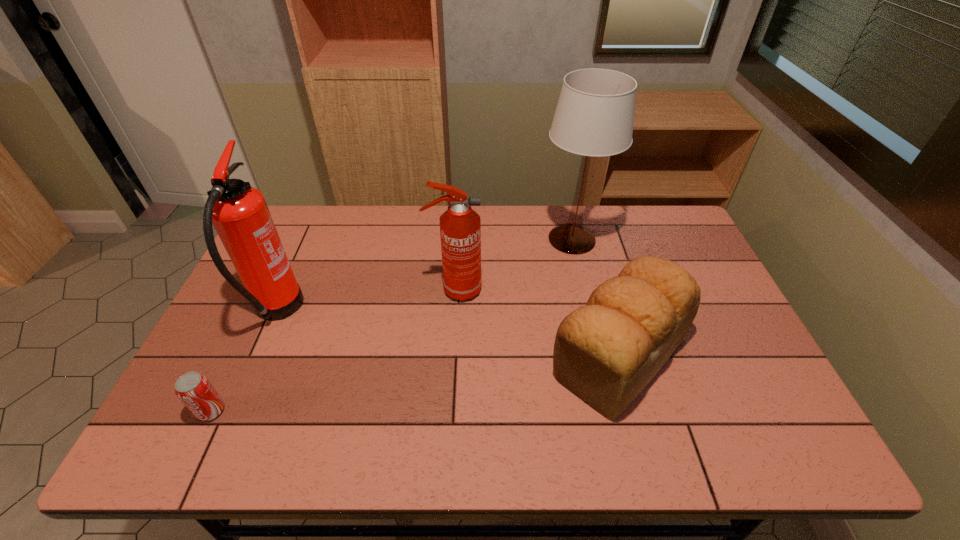
In order to click on empty space between the farthest object and the left fire extinguisher in this screenshot , I will do (x=424, y=276).

Find the location of `free space between the shortest object and the shorter fire extinguisher`. free space between the shortest object and the shorter fire extinguisher is located at coordinates (333, 350).

Find the location of a particular element. The height and width of the screenshot is (540, 960). vacant area that lies between the farthest object and the shortest object is located at coordinates (392, 325).

Where is `vacant area between the taller fire extinguisher and the shortest object`? vacant area between the taller fire extinguisher and the shortest object is located at coordinates (244, 361).

The height and width of the screenshot is (540, 960). Find the location of `object that is the closest to the right fire extinguisher`. object that is the closest to the right fire extinguisher is located at coordinates (606, 352).

Select which object appears as the second closest to the left fire extinguisher. Please provide its 2D coordinates. Your answer should be formatted as a tuple, i.e. [(x, y)], where the tuple contains the x and y coordinates of a point satisfying the conditions above.

[(460, 226)]

Where is `free location that satisfies the following two spatial constraints: 1. at the nozzle of the shorter fire extinguisher; 2. on the logo side of the soda can`? Image resolution: width=960 pixels, height=540 pixels. free location that satisfies the following two spatial constraints: 1. at the nozzle of the shorter fire extinguisher; 2. on the logo side of the soda can is located at coordinates (447, 411).

Image resolution: width=960 pixels, height=540 pixels. Identify the location of free location that satisfies the following two spatial constraints: 1. above the cylindrical shade of the table lamp; 2. on the logo side of the soda can. (612, 411).

You are a GUI agent. You are given a task and a screenshot of the screen. Output one action in this format:
    pyautogui.click(x=<x>, y=<y>)
    Task: Click on the blank area in the image that satisfies the following two spatial constraints: 1. above the cylindrical shade of the second shortest object; 2. on the left side of the farthest object
    
    Given the screenshot: What is the action you would take?
    pyautogui.click(x=599, y=355)

Image resolution: width=960 pixels, height=540 pixels. In order to click on vacant point that satisfies the following two spatial constraints: 1. at the nozzle of the fourth tallest object; 2. on the right side of the shorter fire extinguisher in this screenshot , I will do point(451,355).